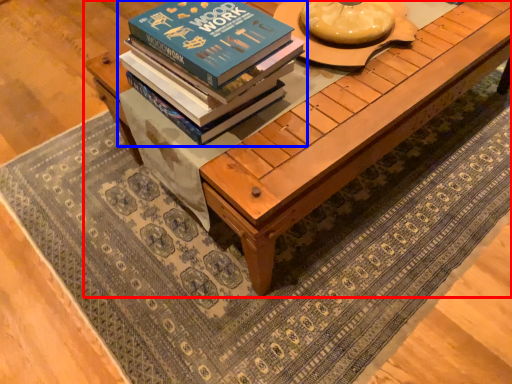
Question: Which object appears closest to the camera in this image, table (highlighted by a red box) or book (highlighted by a blue box)?

Choices:
 (A) table
 (B) book

Answer: (B)